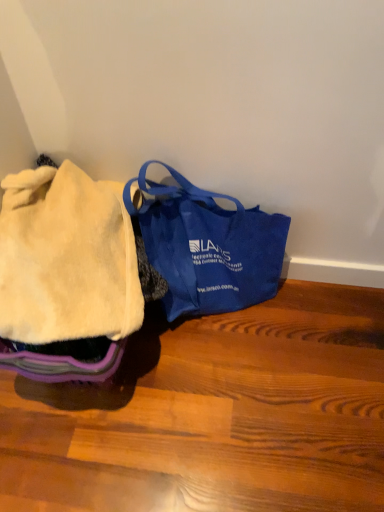
What are the coordinates of `vacant area that is in front of blue canvas bag at center` in the screenshot? It's located at (223, 402).